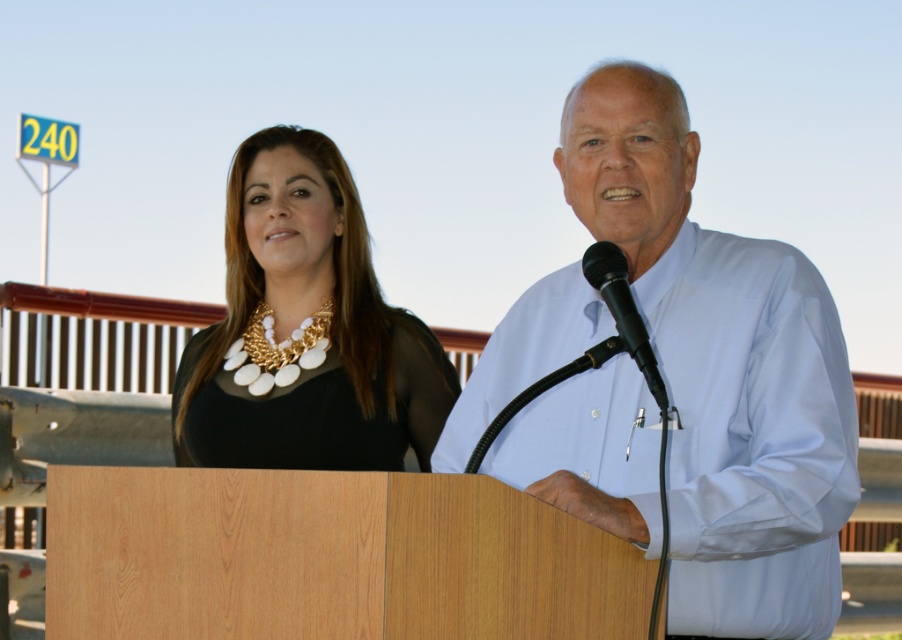
You are a photographer at the event and need to frame a photo that includes both the light blue shirt at center and the black matte necklace at upper left. Which object should you focus on first to ensure both are in the frame?

The light blue shirt at center is much taller than the black matte necklace at upper left, so you should focus on the light blue shirt at center first to ensure both are in the frame.

You are standing at the podium and need to move to the point marked as point (629, 349). Is the point marked as point (764, 616) in front of or behind your current position?

Point (764, 616) is behind point (629, 349), so it is behind your current position.